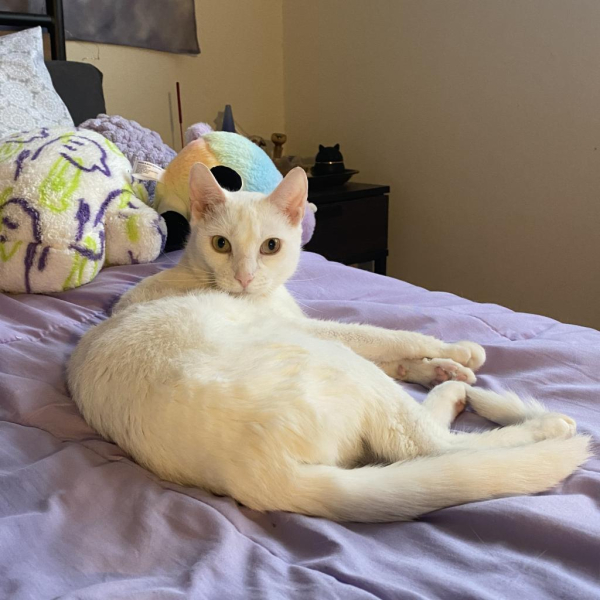
Image resolution: width=600 pixels, height=600 pixels. What are the coordinates of `pillow` in the screenshot? It's located at (43, 220).